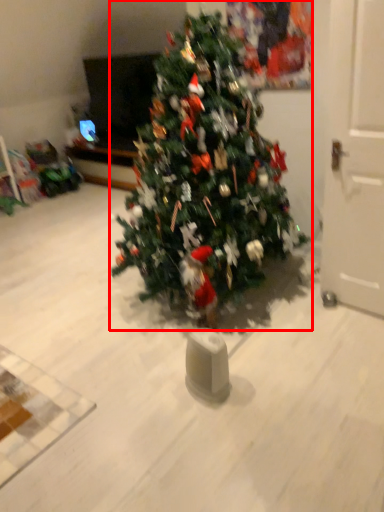
Question: From the image's perspective, where is christmas tree (annotated by the red box) located relative to door?

Choices:
 (A) above
 (B) below

Answer: (A)